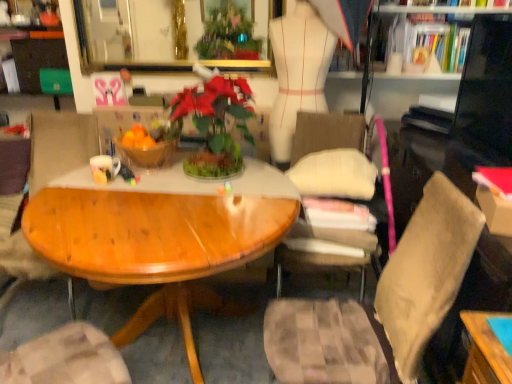
Where is `free spot below red paper book at right, the third book in the back-to-front sequence (from a real-world perspective)`? free spot below red paper book at right, the third book in the back-to-front sequence (from a real-world perspective) is located at coordinates pos(498,183).